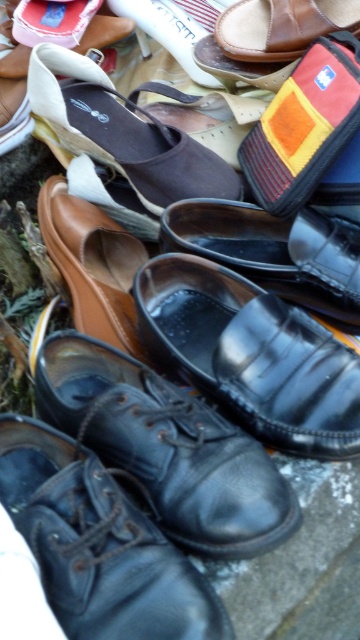
Question: Which object is closer to the camera taking this photo?

Choices:
 (A) black leather dress shoe at lower left
 (B) black leather dress shoe at center
 (C) black leather shoes at center

Answer: (A)

Question: Is black leather dress shoe at center below brown fabric sandal at upper center?

Choices:
 (A) yes
 (B) no

Answer: (A)

Question: Among these points, which one is nearest to the camera?

Choices:
 (A) (149, 276)
 (B) (234, 435)
 (C) (169, 141)

Answer: (B)

Question: Can you confirm if black leather dress shoe at center is smaller than brown fabric sandal at upper center?

Choices:
 (A) no
 (B) yes

Answer: (A)

Question: Which of the following is the closest to the observer?

Choices:
 (A) black leather dress shoe at center
 (B) brown fabric sandal at upper center
 (C) black leather dress shoe at lower left
 (D) black leather shoes at center

Answer: (C)

Question: Does black leather dress shoe at center have a smaller size compared to black leather dress shoe at lower left?

Choices:
 (A) no
 (B) yes

Answer: (A)